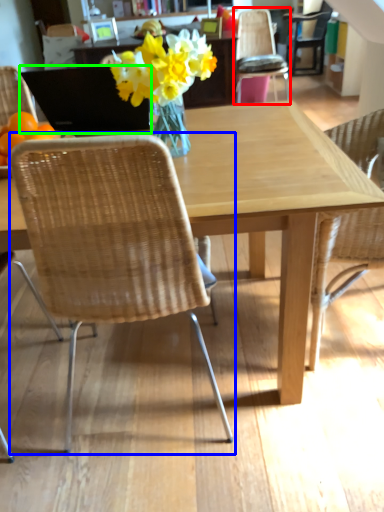
Question: Based on their relative distances, which object is nearer to chair (highlighted by a red box)? Choose from chair (highlighted by a blue box) and laptop (highlighted by a green box).

Choices:
 (A) chair
 (B) laptop

Answer: (B)